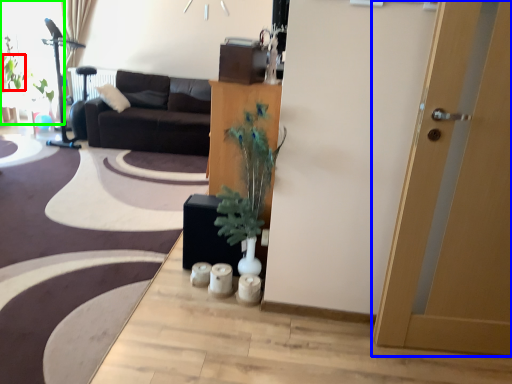
Question: Which is nearer to the plant (highlighted by a red box)? door (highlighted by a blue box) or window screen (highlighted by a green box).

Choices:
 (A) door
 (B) window screen

Answer: (B)